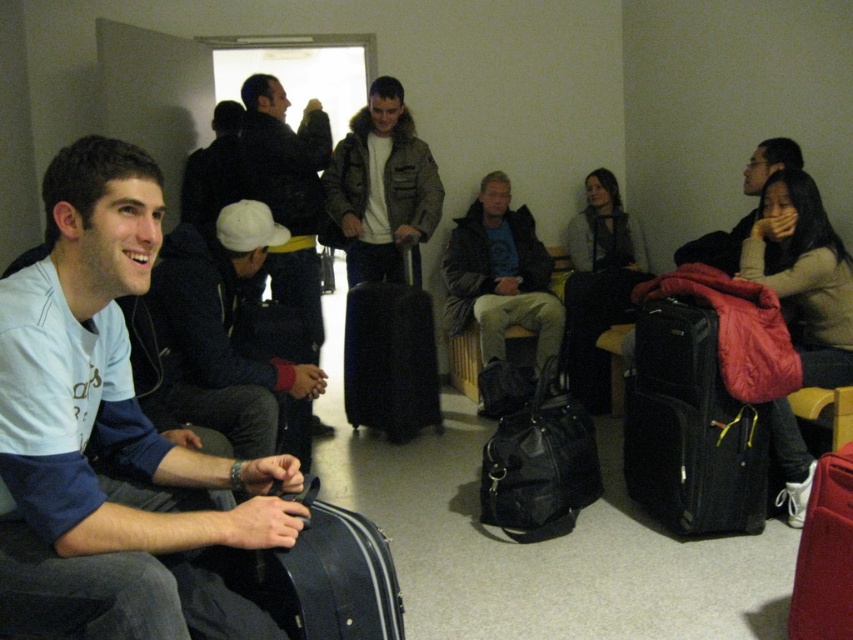
Question: Is matte brown jacket at center below matte black suitcase at center?

Choices:
 (A) yes
 (B) no

Answer: (B)

Question: Can you confirm if black fuzzy jacket at center is smaller than matte red suitcase at lower right?

Choices:
 (A) yes
 (B) no

Answer: (B)

Question: Is white matte shirt at left to the left of black leather suitcase at lower center from the viewer's perspective?

Choices:
 (A) no
 (B) yes

Answer: (B)

Question: Estimate the real-world distances between objects in this image. Which object is closer to the dark brown leather jacket at upper right?

Choices:
 (A) matte black suitcase at center
 (B) black fabric suitcase at right
 (C) light blue fleece at left
 (D) dark gray fabric jacket at center

Answer: (D)

Question: Among these objects, which one is nearest to the camera?

Choices:
 (A) black fabric suitcase at right
 (B) matte black suitcase at center

Answer: (A)

Question: Which point appears farthest from the camera in this image?

Choices:
 (A) (773, 410)
 (B) (415, 228)
 (C) (242, 218)

Answer: (B)